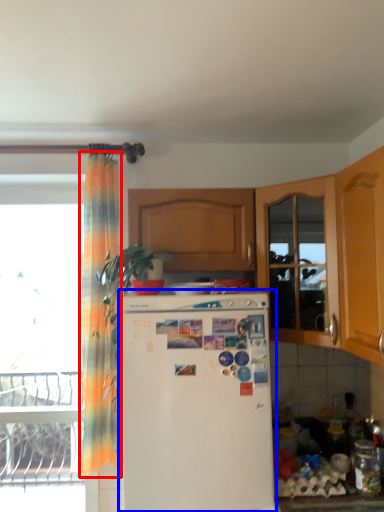
Question: Which object appears closest to the camera in this image, curtain (highlighted by a red box) or refrigerator (highlighted by a blue box)?

Choices:
 (A) curtain
 (B) refrigerator

Answer: (B)